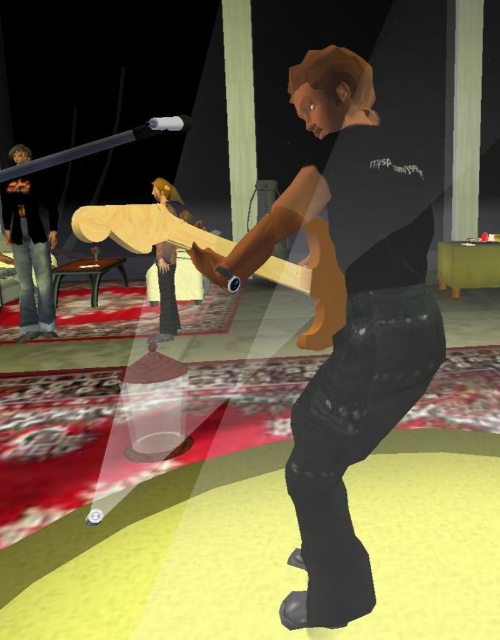
Locate an element on the screen. The width and height of the screenshot is (500, 640). brown matte shirt at center is located at coordinates (348, 320).

Is point (346, 340) in front of point (175, 252)?

Yes, point (346, 340) is closer to viewer.

Is point (384, 257) positioned behind point (165, 294)?

No, it is not.

Locate an element on the screen. The image size is (500, 640). brown matte shirt at center is located at coordinates (348, 320).

Is brown matte shirt at center in front of denim jeans at left?

Yes, it is.

Where is `brown matte shirt at center`? The width and height of the screenshot is (500, 640). brown matte shirt at center is located at coordinates (348, 320).

Between denim jeans at left and wooden skateboard at center, which one appears on the left side from the viewer's perspective?

Positioned to the left is denim jeans at left.

Is denim jeans at left positioned behind wooden skateboard at center?

Yes, it is.

Does point (44, 202) come farther from viewer compared to point (165, 317)?

That is True.

The height and width of the screenshot is (640, 500). I want to click on denim jeans at left, so click(x=32, y=252).